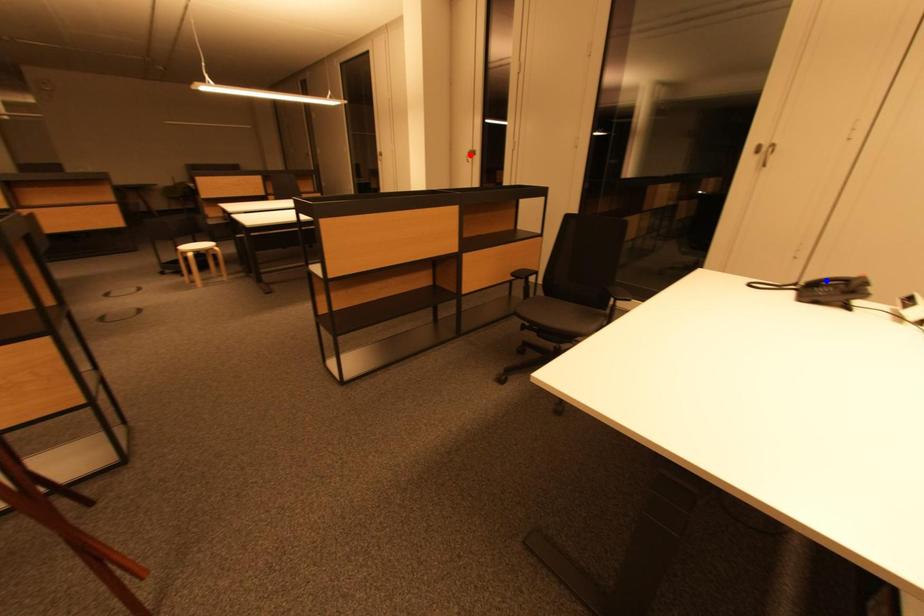
Question: Two points are marked on the image. Which point is closer to the camera?

Choices:
 (A) Blue point is closer.
 (B) Red point is closer.

Answer: (A)